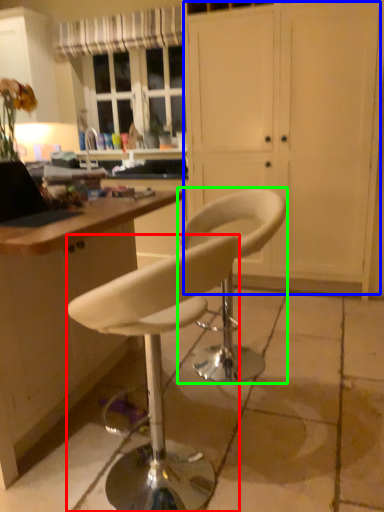
Question: Based on their relative distances, which object is farther from chair (highlighted by a red box)? Choose from screen door (highlighted by a blue box) and chair (highlighted by a green box).

Choices:
 (A) screen door
 (B) chair

Answer: (A)